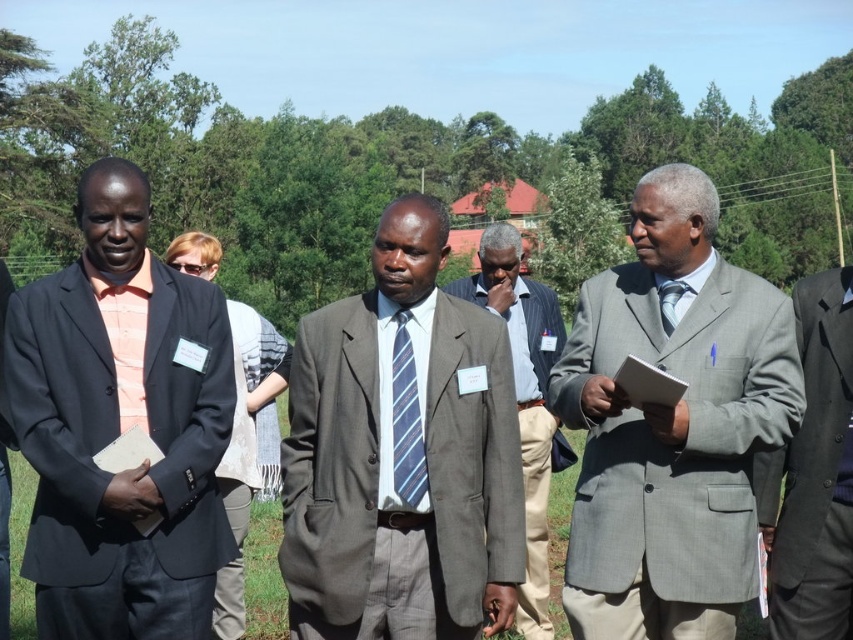
You are organizing a photo shoot for a magazine and need to arrange two models wearing the matte gray suit at center and the matte black suit at left. Since you want to emphasize the size difference between the suits, how should you position them relative to each other?

To emphasize the size difference between the matte gray suit at center and the matte black suit at left, position the matte gray suit at center closer to the camera and the matte black suit at left further away. This arrangement will make the larger matte gray suit appear even bigger compared to the smaller matte black suit at left.

What are the coordinates of the matte gray suit at center?

The coordinates of the matte gray suit at center are point [401,456].

You are organizing a photo shoot and need to ensure that the matte black suit at left and the blue striped tie at center are visible in the frame. Given that the camera has a fixed width, which object should you prioritize framing closer to avoid cropping?

The matte black suit at left should be prioritized closer to the camera since it is wider than the blue striped tie at center, ensuring it fits within the frame without cropping.